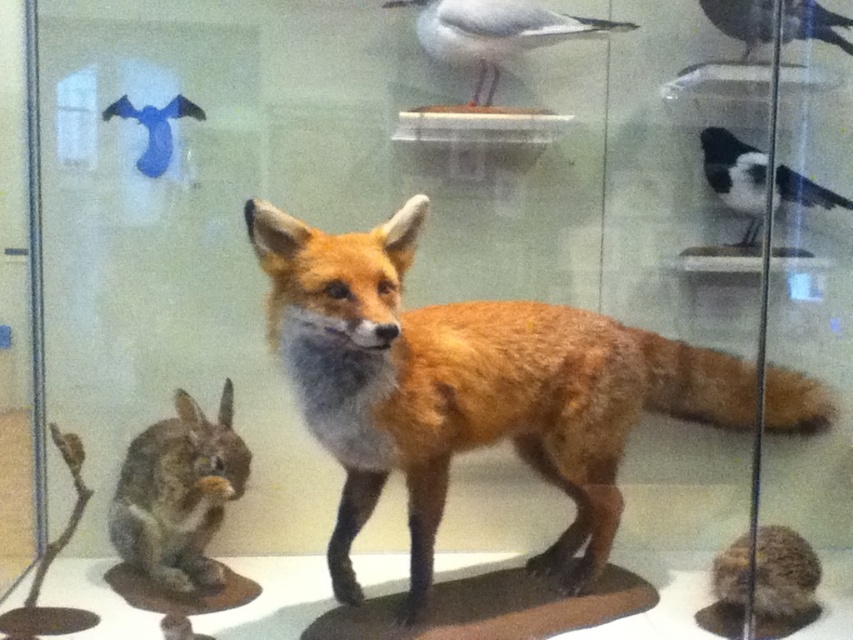
Question: Can you confirm if fuzzy brown fur at lower left is positioned above shiny black bird at upper right?

Choices:
 (A) no
 (B) yes

Answer: (A)

Question: Which object is farther from the camera taking this photo?

Choices:
 (A) fuzzy brown fur at lower left
 (B) blue matte bird at upper left

Answer: (B)

Question: Can you confirm if shiny black bird at upper right is bigger than blue matte bird at upper left?

Choices:
 (A) no
 (B) yes

Answer: (B)

Question: Among these points, which one is nearest to the camera?

Choices:
 (A) (822, 196)
 (B) (480, 77)
 (C) (146, 106)

Answer: (C)

Question: Which point appears farthest from the camera in this image?

Choices:
 (A) (827, 42)
 (B) (532, 428)

Answer: (A)

Question: Is shiny brown fur at center thinner than black glossy bird at upper right?

Choices:
 (A) no
 (B) yes

Answer: (A)